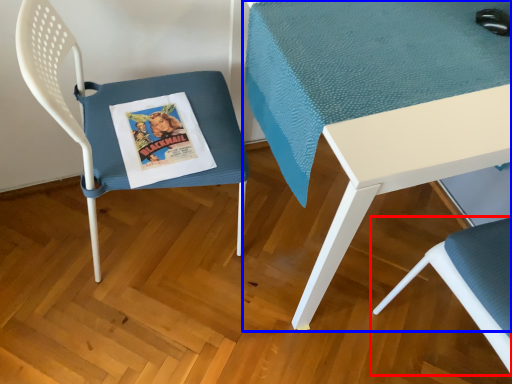
Question: Which of the following is the closest to the observer, chair (highlighted by a red box) or table (highlighted by a blue box)?

Choices:
 (A) chair
 (B) table

Answer: (A)